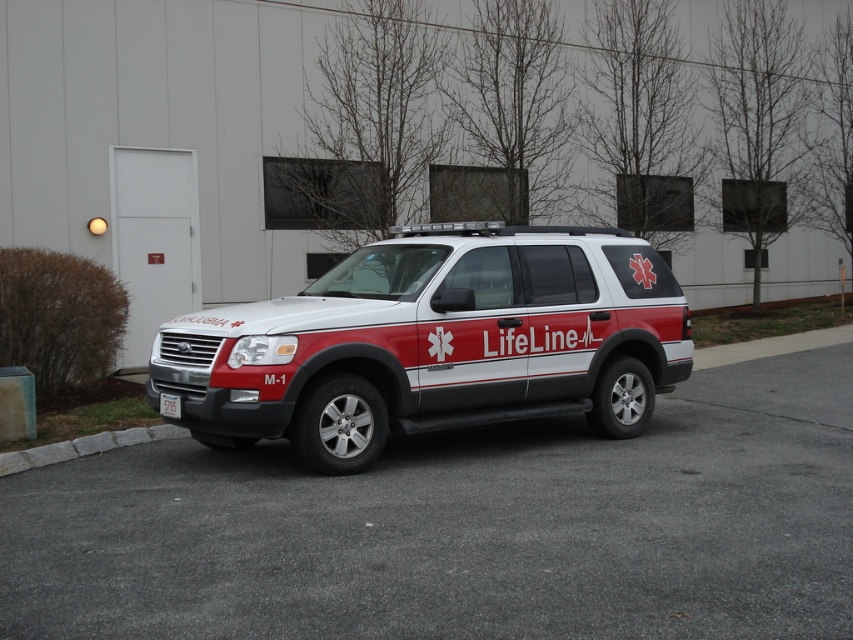
Consider the image. You are a driver approaching the white matte suv at center and the white plastic license plate at center. Which object is closer to the left side of the road?

The white plastic license plate at center is closer to the left side of the road because the white matte suv at center is to the right of it.

You are a photographer setting up a tripod to capture the white matte suv at center and the white plastic license plate at center. Since you want to focus on both objects equally, which object should you position closer to the camera to ensure they appear the same size in the photo?

The white plastic license plate at center should be positioned closer to the camera because it is smaller in height than the white matte suv at center. By placing the smaller object closer, they will appear the same size in the photo.